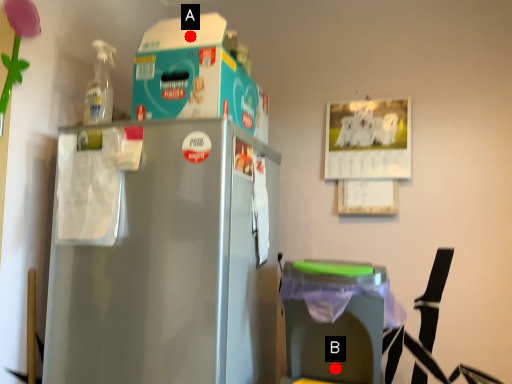
Question: Two points are circled on the image, labeled by A and B beside each circle. Among these points, which one is nearest to the camera?

Choices:
 (A) A is closer
 (B) B is closer

Answer: (B)